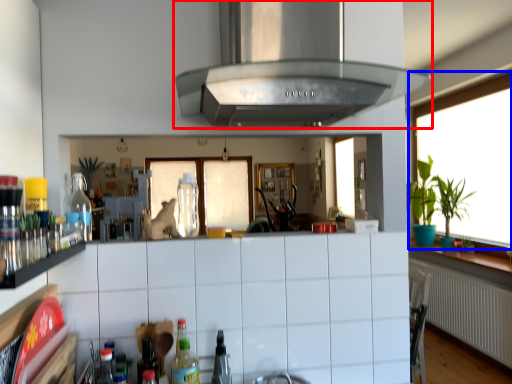
Question: Which object appears closest to the camera in this image, exhaust hood (highlighted by a red box) or window (highlighted by a blue box)?

Choices:
 (A) exhaust hood
 (B) window

Answer: (A)